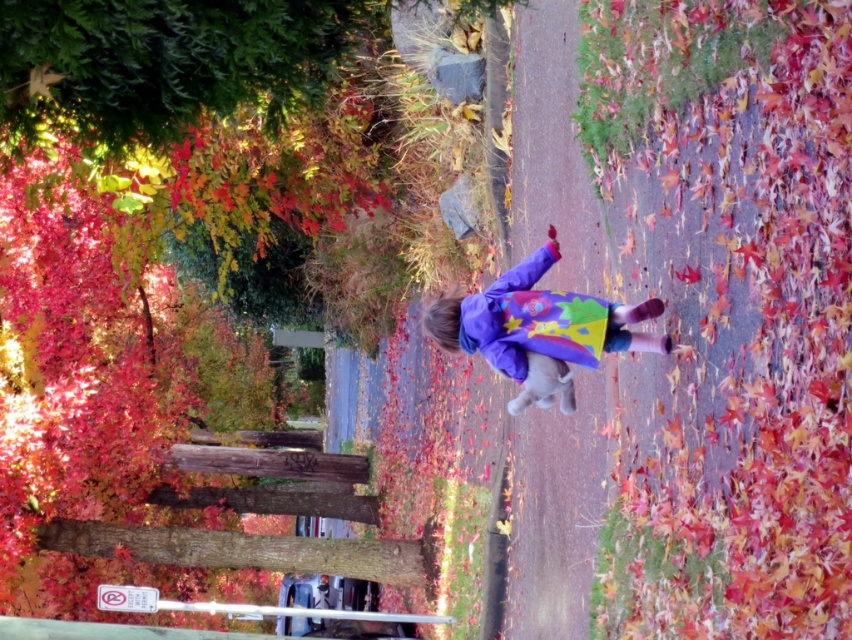
Does multicolored fabric at center have a larger size compared to green leafy tree at upper left?

Correct, multicolored fabric at center is larger in size than green leafy tree at upper left.

Does multicolored fabric at center have a greater width compared to green leafy tree at upper left?

No, multicolored fabric at center is not wider than green leafy tree at upper left.

Locate an element on the screen. The image size is (852, 640). multicolored fabric at center is located at coordinates (x=730, y=307).

Can you confirm if multicolored fabric at center is positioned to the left of purple fleece jacket at center?

No, multicolored fabric at center is not to the left of purple fleece jacket at center.

Is multicolored fabric at center to the right of purple fleece jacket at center from the viewer's perspective?

Indeed, multicolored fabric at center is positioned on the right side of purple fleece jacket at center.

Where is `multicolored fabric at center`? This screenshot has width=852, height=640. multicolored fabric at center is located at coordinates (730, 307).

Locate an element on the screen. multicolored fabric at center is located at coordinates (730, 307).

Is green leafy tree at upper left taller than purple fleece jacket at center?

No.

Is green leafy tree at upper left to the left of purple fleece jacket at center from the viewer's perspective?

Correct, you'll find green leafy tree at upper left to the left of purple fleece jacket at center.

The height and width of the screenshot is (640, 852). What are the coordinates of `green leafy tree at upper left` in the screenshot? It's located at (165, 61).

Find the location of a particular element. green leafy tree at upper left is located at coordinates (165, 61).